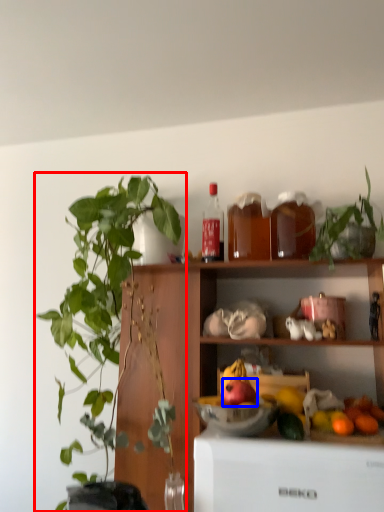
Question: Which object appears farthest to the camera in this image, houseplant (highlighted by a red box) or apple (highlighted by a blue box)?

Choices:
 (A) houseplant
 (B) apple

Answer: (B)